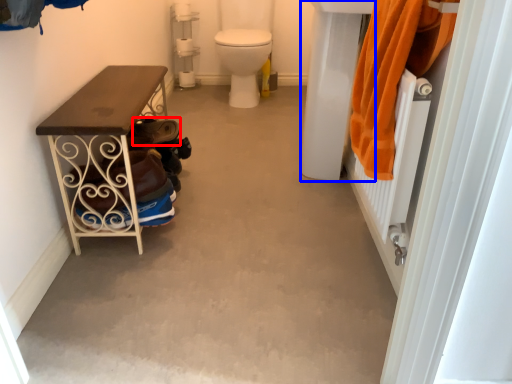
Question: Which object is further to the camera taking this photo, shoe (highlighted by a red box) or sink (highlighted by a blue box)?

Choices:
 (A) shoe
 (B) sink

Answer: (A)